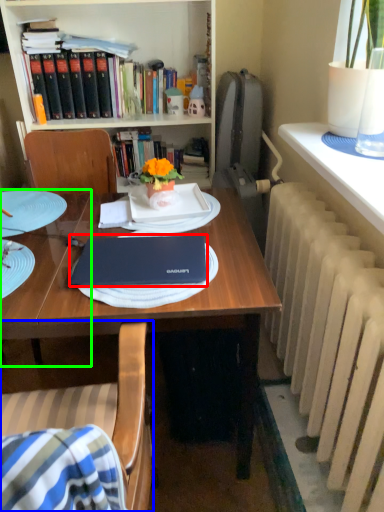
Question: Estimate the real-world distances between objects in this image. Which object is closer to laptop (highlighted by a red box), chair (highlighted by a blue box) or table (highlighted by a green box)?

Choices:
 (A) chair
 (B) table

Answer: (A)